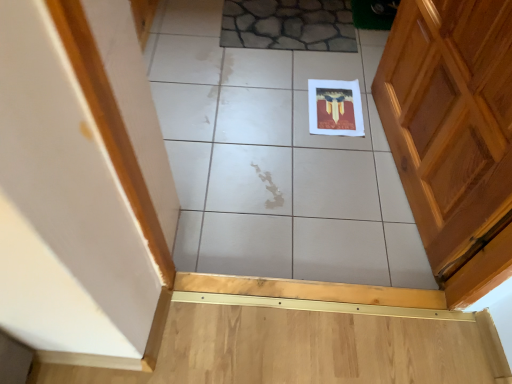
Where is `vacant space underneath stone-like ceramic tile at upper center, the 1th ceramic tile from the top (from a real-world perspective)`? vacant space underneath stone-like ceramic tile at upper center, the 1th ceramic tile from the top (from a real-world perspective) is located at coordinates (290, 31).